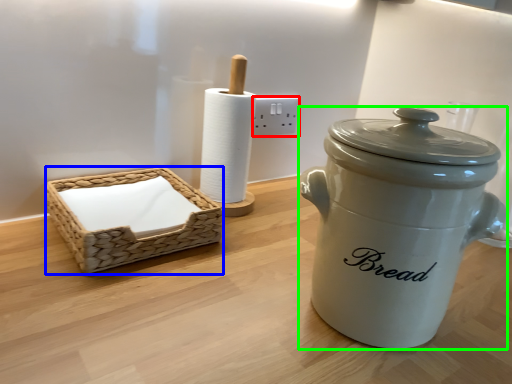
Question: Which is nearer to the electric outlet (highlighted by a red box)? basket (highlighted by a blue box) or crock pot (highlighted by a green box).

Choices:
 (A) basket
 (B) crock pot

Answer: (A)